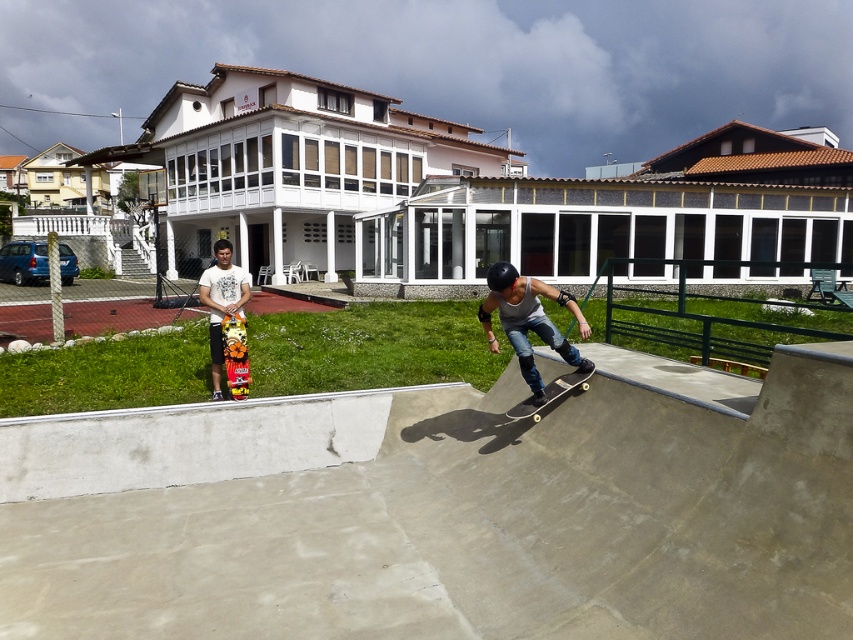
Can you confirm if matte gray tank top at center is positioned below multicolored wooden skateboard at center?

Actually, matte gray tank top at center is above multicolored wooden skateboard at center.

How far apart are matte gray tank top at center and multicolored wooden skateboard at center?

matte gray tank top at center is 3.10 meters away from multicolored wooden skateboard at center.

Is point (503, 278) more distant than point (229, 340)?

No.

Where is `matte gray tank top at center`? matte gray tank top at center is located at coordinates (529, 321).

Can you confirm if concrete ramp at center is positioned below multicolored wooden skateboard at center?

Indeed, concrete ramp at center is positioned under multicolored wooden skateboard at center.

Does concrete ramp at center have a lesser height compared to multicolored wooden skateboard at center?

In fact, concrete ramp at center may be taller than multicolored wooden skateboard at center.

The image size is (853, 640). I want to click on concrete ramp at center, so click(x=486, y=520).

In order to click on concrete ramp at center in this screenshot , I will do `click(486, 520)`.

Is white t-shirt at center bigger than multicolored wooden skateboard at center?

Yes, white t-shirt at center is bigger than multicolored wooden skateboard at center.

Which is in front, point (216, 381) or point (227, 317)?

Point (227, 317) is more forward.

The width and height of the screenshot is (853, 640). What do you see at coordinates (221, 301) in the screenshot?
I see `white t-shirt at center` at bounding box center [221, 301].

I want to click on white t-shirt at center, so click(221, 301).